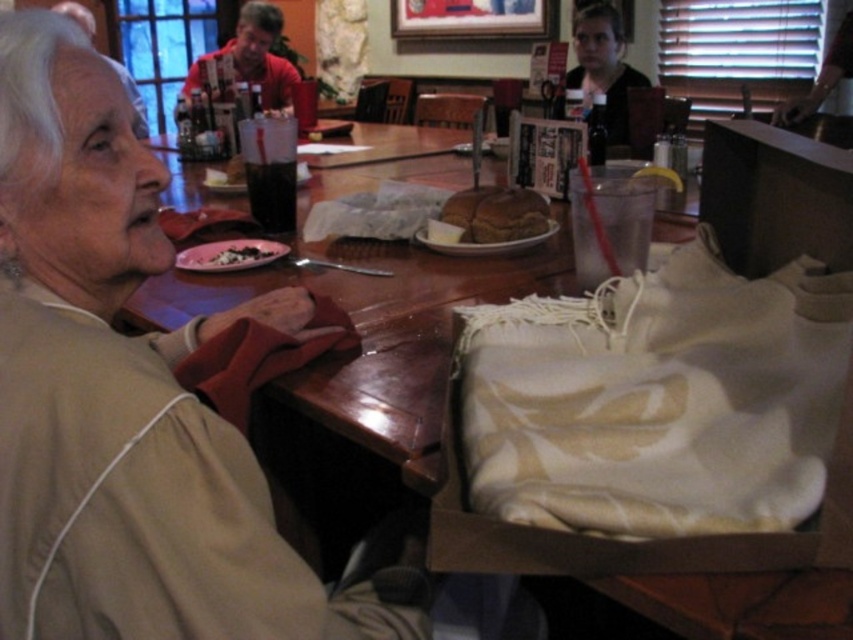
Question: Which object appears farthest from the camera in this image?

Choices:
 (A) red shirt at upper center
 (B) yellow lemon slice at upper center

Answer: (A)

Question: Is red shirt at upper center closer to camera compared to brown crusty bread at center?

Choices:
 (A) no
 (B) yes

Answer: (A)

Question: Which point is closer to the camera taking this photo?

Choices:
 (A) (292, 68)
 (B) (654, 172)

Answer: (B)

Question: Estimate the real-world distances between objects in this image. Which object is closer to the black matte food at center?

Choices:
 (A) yellow lemon slice at upper center
 (B) brown crusty bread at center
 (C) matte black jacket at upper center
 (D) red shirt at upper center

Answer: (B)

Question: Observing the image, what is the correct spatial positioning of brown crusty bread at center in reference to yellow lemon slice at upper center?

Choices:
 (A) above
 (B) below

Answer: (B)

Question: Can you confirm if matte black jacket at upper center is positioned above yellow lemon slice at upper center?

Choices:
 (A) yes
 (B) no

Answer: (A)